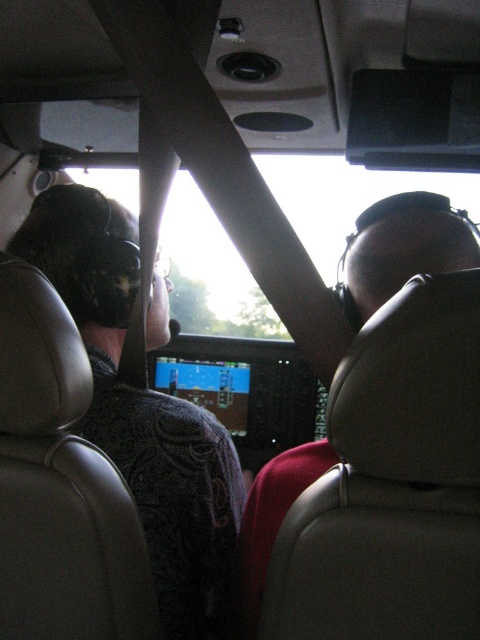
Question: Is matte black helmet at left smaller than matte black helmet at right?

Choices:
 (A) no
 (B) yes

Answer: (A)

Question: Which of the following is the farthest from the observer?

Choices:
 (A) matte black helmet at right
 (B) matte black helmet at left

Answer: (B)

Question: Which point is farther to the camera?

Choices:
 (A) [475, 241]
 (B) [200, 477]

Answer: (B)

Question: Is the position of matte black helmet at left less distant than that of matte black helmet at right?

Choices:
 (A) no
 (B) yes

Answer: (A)

Question: Does matte black helmet at left come in front of matte black helmet at right?

Choices:
 (A) yes
 (B) no

Answer: (B)